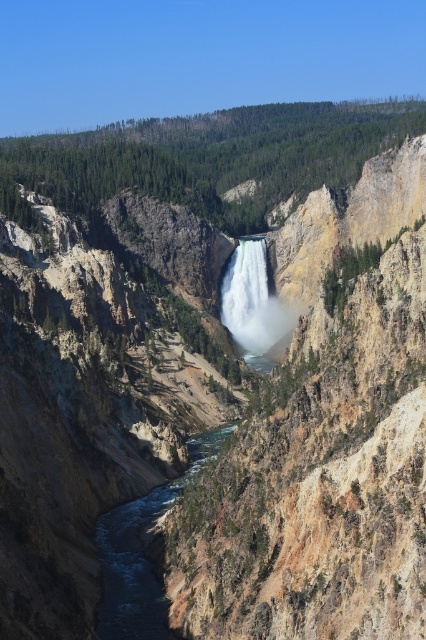
Does point (138, 516) come farther from viewer compared to point (230, 262)?

No, (138, 516) is in front of (230, 262).

Is clear water at center bigger than white smooth waterfall at center?

Actually, clear water at center might be smaller than white smooth waterfall at center.

Between point (123, 609) and point (252, 332), which one is positioned behind?

The point (252, 332) is more distant.

This screenshot has width=426, height=640. What are the coordinates of `clear water at center` in the screenshot? It's located at (141, 554).